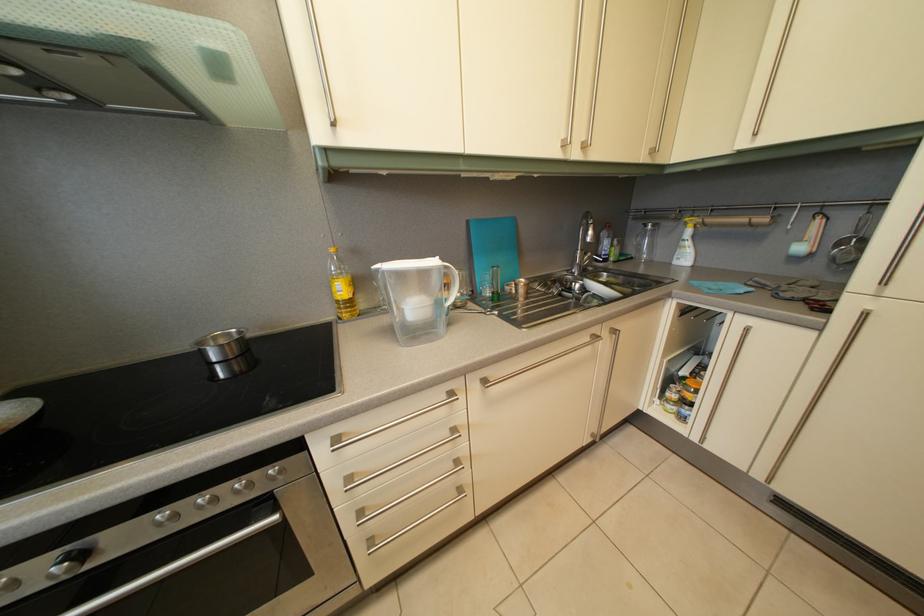
Describe the element at coordinates (129, 533) in the screenshot. I see `the oven door handle` at that location.